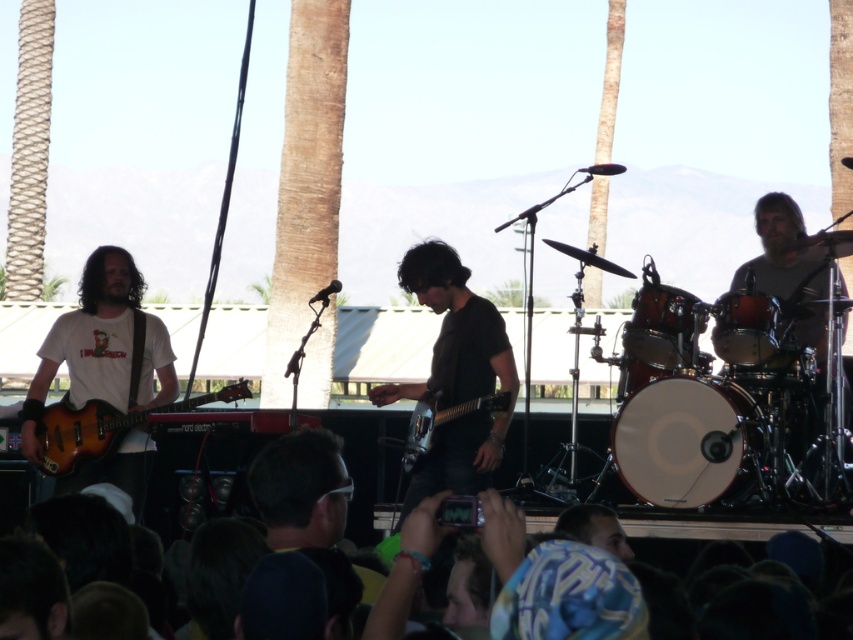
Question: Which object is farther from the camera taking this photo?

Choices:
 (A) matte black drum at center
 (B) sunburst wood electric guitar at left
 (C) shiny metallic guitar at center

Answer: (A)

Question: Which point is farther to the camera?

Choices:
 (A) (656, 284)
 (B) (138, 445)

Answer: (B)

Question: Estimate the real-world distances between objects in this image. Which object is farther from the matte brown guitar at left?

Choices:
 (A) matte black drum at center
 (B) shiny metallic guitar at center
 (C) sunburst wood electric guitar at left

Answer: (A)

Question: Does dark gray shirt at center have a lesser width compared to matte black drum at center?

Choices:
 (A) no
 (B) yes

Answer: (A)

Question: Does dark gray shirt at center appear on the right side of sunburst wood electric guitar at left?

Choices:
 (A) yes
 (B) no

Answer: (A)

Question: Is dark gray shirt at center wider than shiny metallic drum at center right?

Choices:
 (A) no
 (B) yes

Answer: (B)